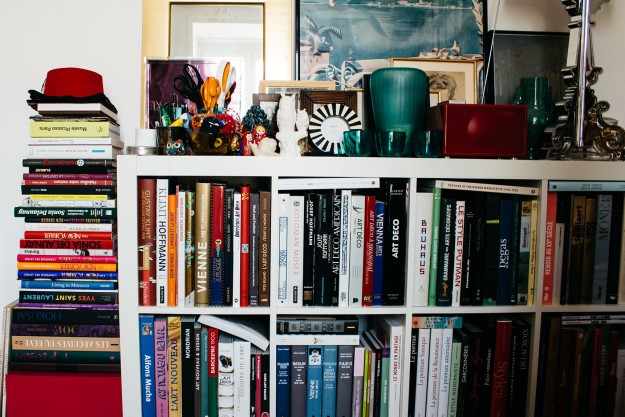
Identify the location of books on upper shelf, second cubbyhole from the left. (284, 223), (296, 233), (308, 238), (320, 228), (336, 236), (342, 240), (352, 244), (367, 251), (378, 253), (391, 258).